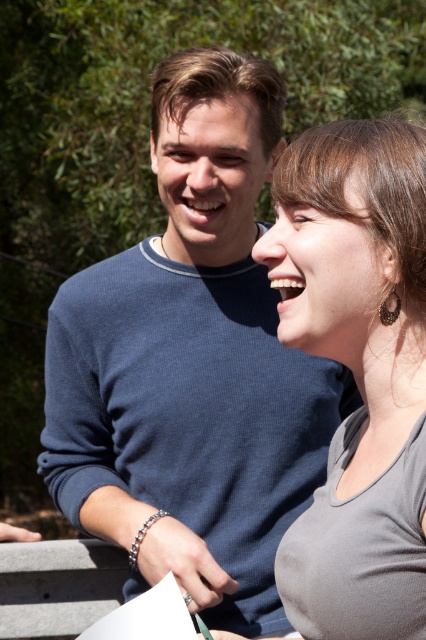
Question: Which point is farther to the camera?

Choices:
 (A) gray matte tank top at right
 (B) blue ribbed sweater at upper left

Answer: (B)

Question: Can you confirm if blue ribbed sweater at upper left is wider than gray matte tank top at right?

Choices:
 (A) no
 (B) yes

Answer: (B)

Question: Is blue ribbed sweater at upper left below gray matte tank top at right?

Choices:
 (A) no
 (B) yes

Answer: (A)

Question: Which point is closer to the camera?

Choices:
 (A) gray matte tank top at right
 (B) blue ribbed sweater at upper left

Answer: (A)

Question: Does blue ribbed sweater at upper left have a lesser width compared to gray matte tank top at right?

Choices:
 (A) no
 (B) yes

Answer: (A)